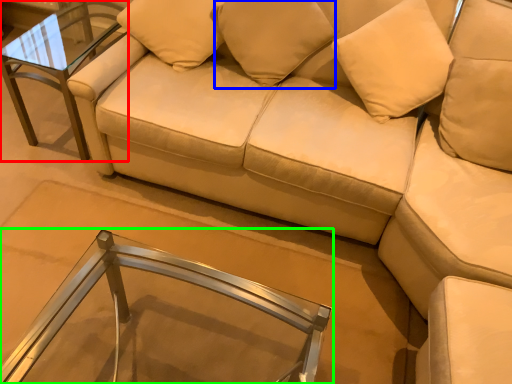
Question: Estimate the real-world distances between objects in this image. Which object is closer to table (highlighted by a red box), pillow (highlighted by a blue box) or table (highlighted by a green box)?

Choices:
 (A) pillow
 (B) table

Answer: (A)